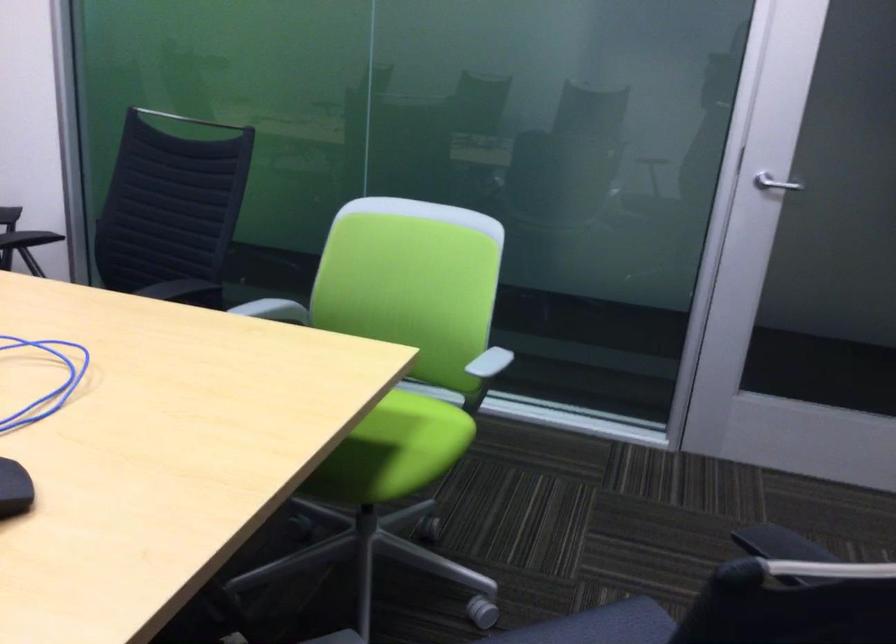
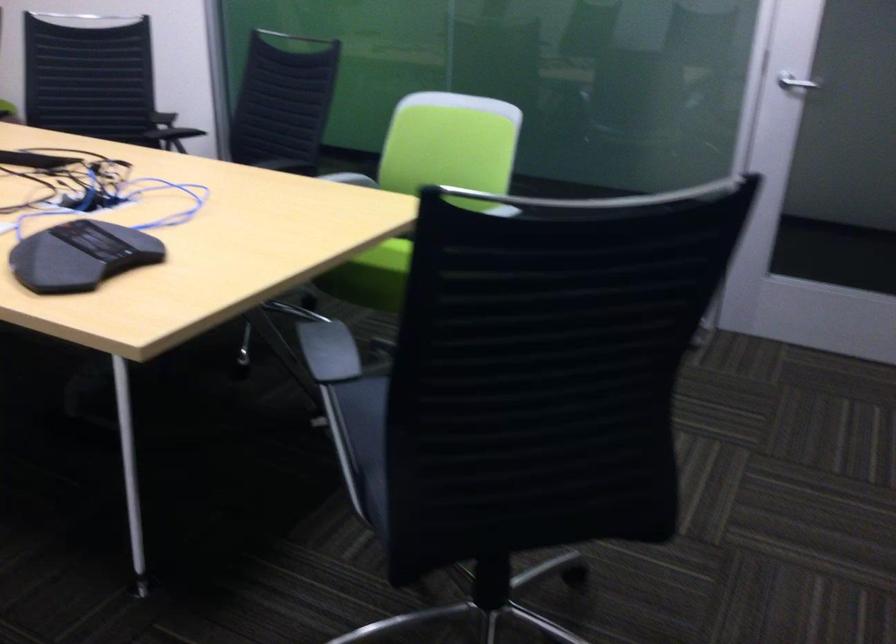
Question: The camera is either moving clockwise (left) or counter-clockwise (right) around the object. The first image is from the beginning of the video and the second image is from the end. Is the camera moving left or right when shooting the video?

Choices:
 (A) Left
 (B) Right

Answer: (B)